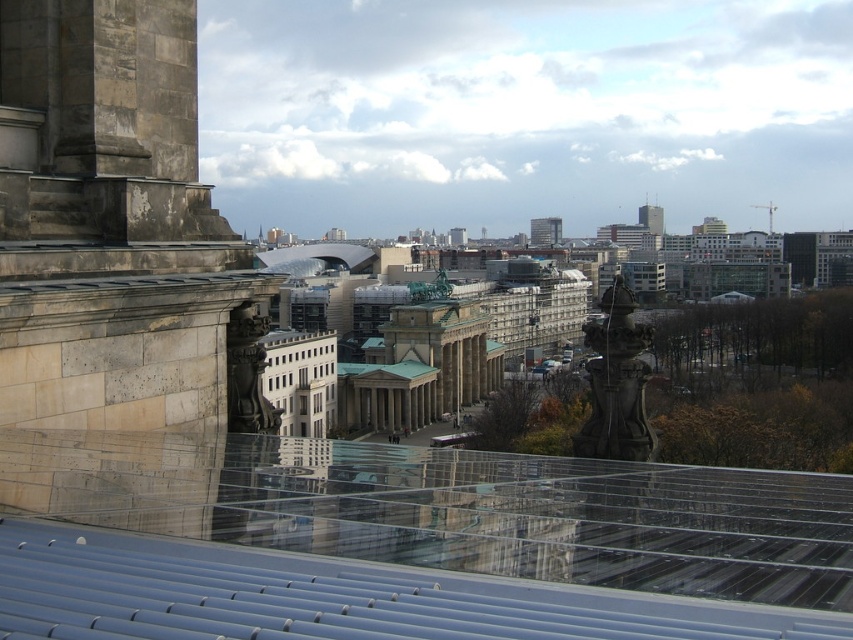
Is point (32, 358) positioned behind point (604, 337)?

No, (32, 358) is in front of (604, 337).

Measure the distance between point (207, 260) and camera.

Point (207, 260) and camera are 100.61 feet apart.

Is point (190, 291) positioned after point (599, 333)?

No, (190, 291) is in front of (599, 333).

You are a GUI agent. You are given a task and a screenshot of the screen. Output one action in this format:
    pyautogui.click(x=<x>, y=<y>)
    Task: Click on the beige stone tower at left
    This screenshot has height=640, width=853.
    Given the screenshot: What is the action you would take?
    pyautogui.click(x=113, y=227)

Is polished stone column at center smaller than metallic glass tower at center?

Actually, polished stone column at center might be larger than metallic glass tower at center.

Who is lower down, polished stone column at center or metallic glass tower at center?

polished stone column at center is lower down.

The image size is (853, 640). Identify the location of polished stone column at center. (616, 381).

This screenshot has height=640, width=853. I want to click on polished stone column at center, so click(x=616, y=381).

Which is above, transparent glass roof at center or polished stone column at center?

Positioned higher is transparent glass roof at center.

Is transparent glass roof at center thinner than polished stone column at center?

No, transparent glass roof at center is not thinner than polished stone column at center.

Measure the distance between point [427,490] and camera.

Point [427,490] is 25.36 meters from camera.

The width and height of the screenshot is (853, 640). What are the coordinates of `transparent glass roof at center` in the screenshot? It's located at (408, 545).